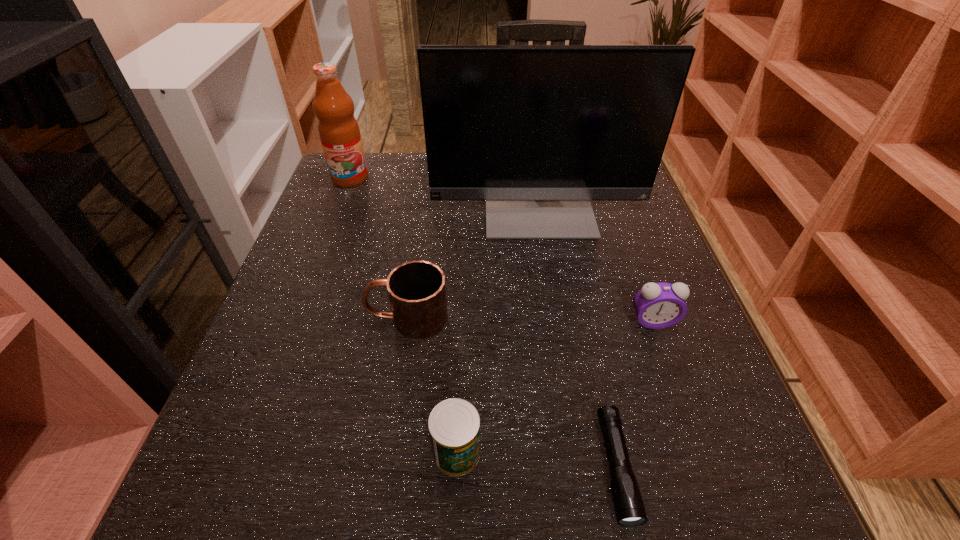
This screenshot has height=540, width=960. In order to click on alarm clock situated at the right edge in this screenshot , I will do `click(657, 305)`.

Where is `object that is at the far left corner`? The height and width of the screenshot is (540, 960). object that is at the far left corner is located at coordinates (339, 132).

This screenshot has width=960, height=540. What are the coordinates of `object located in the far right corner section of the desktop` in the screenshot? It's located at (537, 131).

Identify the location of vacant region at the far edge of the desktop. The width and height of the screenshot is (960, 540). (420, 188).

Where is `vacant space at the near edge of the desktop`? The image size is (960, 540). vacant space at the near edge of the desktop is located at coordinates (516, 465).

This screenshot has height=540, width=960. Identify the location of vacant space at the left edge of the desktop. (289, 458).

This screenshot has width=960, height=540. Find the location of `free space at the right edge of the desktop`. free space at the right edge of the desktop is located at coordinates (618, 211).

I want to click on vacant region at the far left corner of the desktop, so click(x=388, y=173).

Where is `vacant point located between the alarm clock and the shortest object`? vacant point located between the alarm clock and the shortest object is located at coordinates (635, 394).

At what (x,y) coordinates should I click in order to perform the action: click on free space between the mug and the alarm clock. Please return your answer as a coordinate pair (x, y). Looking at the image, I should click on (530, 320).